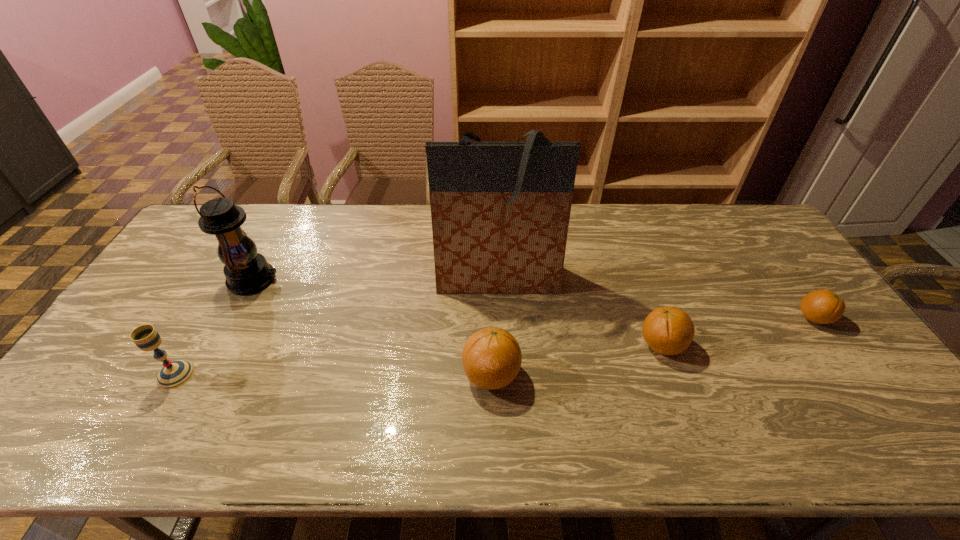
I want to click on vacant space located 0.180m on the back of the second orange from left to right, so click(638, 282).

This screenshot has height=540, width=960. Find the location of `vacant space located 0.130m on the back of the shortest object`. vacant space located 0.130m on the back of the shortest object is located at coordinates (783, 275).

The height and width of the screenshot is (540, 960). Identify the location of free space located on the back of the chalice. (212, 311).

Point to any free space located 0.380m above the second tallest object, indicating its light source in the image. Please provide its 2D coordinates. Your answer should be formatted as a tuple, i.e. [(x, y)], where the tuple contains the x and y coordinates of a point satisfying the conditions above.

[(401, 279)]

Where is `free space located on the front-facing side of the tallest object`? free space located on the front-facing side of the tallest object is located at coordinates (502, 388).

Find the location of a particular element. This screenshot has width=960, height=540. orange that is positioned at the near edge is located at coordinates (491, 357).

What are the coordinates of `chalice at the near edge` in the screenshot? It's located at (174, 374).

Image resolution: width=960 pixels, height=540 pixels. Identify the location of object that is at the right edge. (822, 306).

Identify the location of blank space at the far edge. (287, 204).

Locate an element on the screen. This screenshot has width=960, height=540. vacant region at the near edge of the desktop is located at coordinates (383, 402).